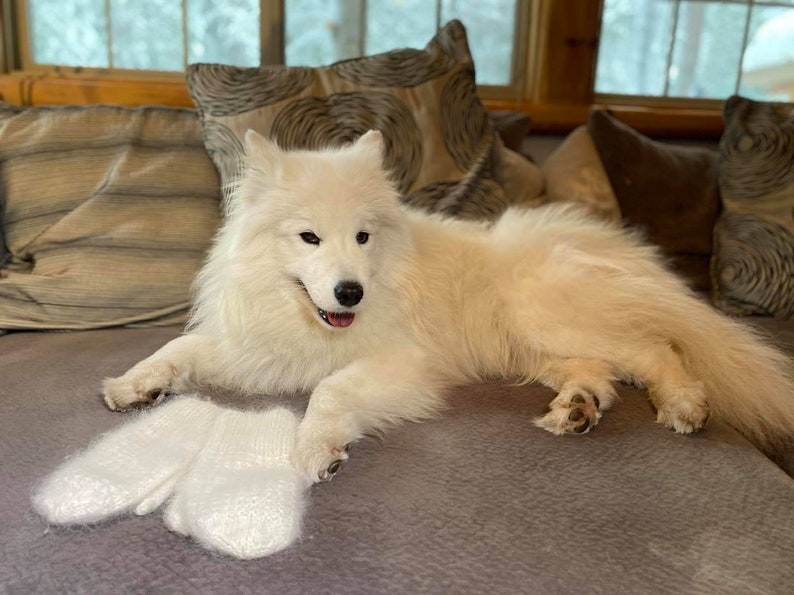
Locate an element on the screen. brown wood around windows is located at coordinates (55, 79), (569, 49).